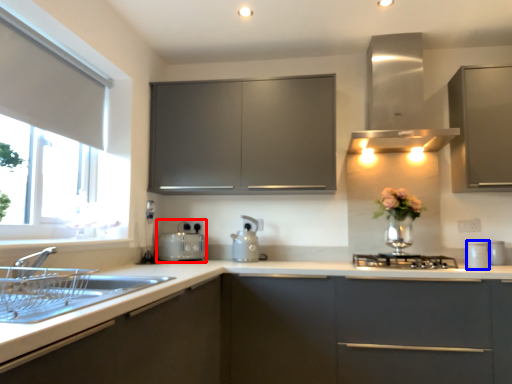
Question: Among these objects, which one is nearest to the camera, appliance (highlighted by a red box) or appliance (highlighted by a blue box)?

Choices:
 (A) appliance
 (B) appliance

Answer: (B)